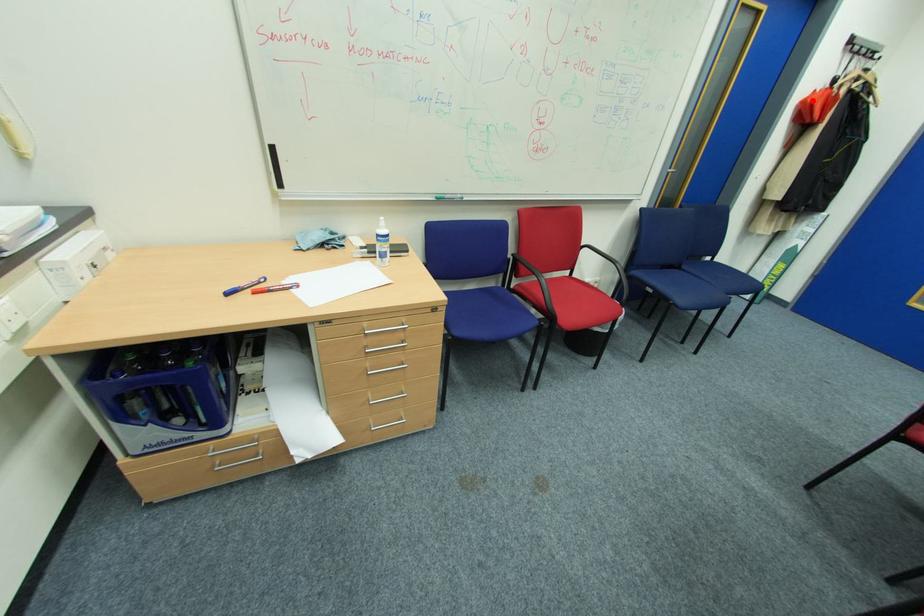
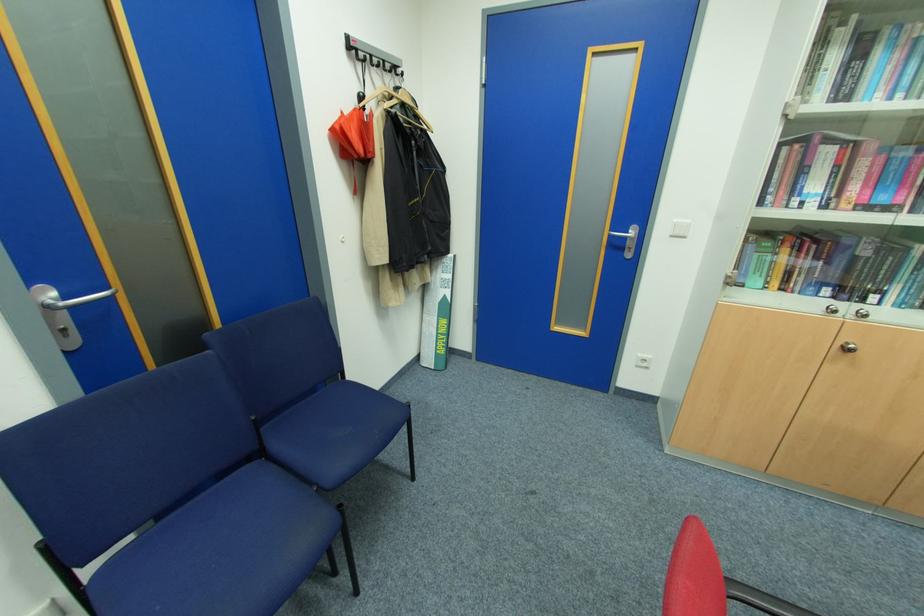
The point at the highlighted location is marked in the first image. Where is the corresponding point in the second image?

(341, 127)